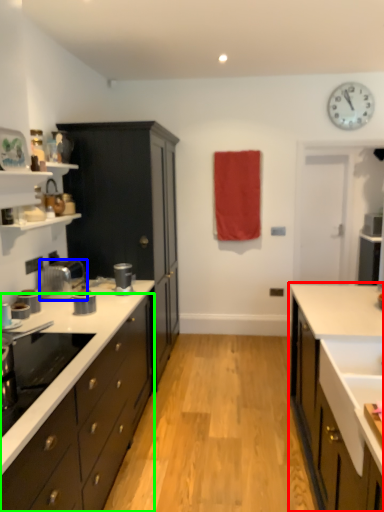
Question: Which object is the farthest from cabinetry (highlighted by a red box)? Choose among these: kitchen appliance (highlighted by a blue box) or cabinetry (highlighted by a green box).

Choices:
 (A) kitchen appliance
 (B) cabinetry

Answer: (A)